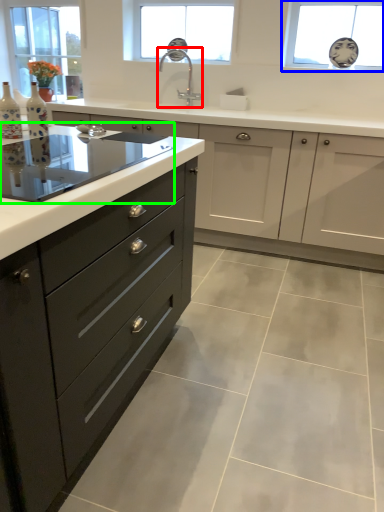
Question: Considering the real-world distances, which object is farthest from sink (highlighted by a red box)? window (highlighted by a blue box) or home appliance (highlighted by a green box)?

Choices:
 (A) window
 (B) home appliance

Answer: (B)